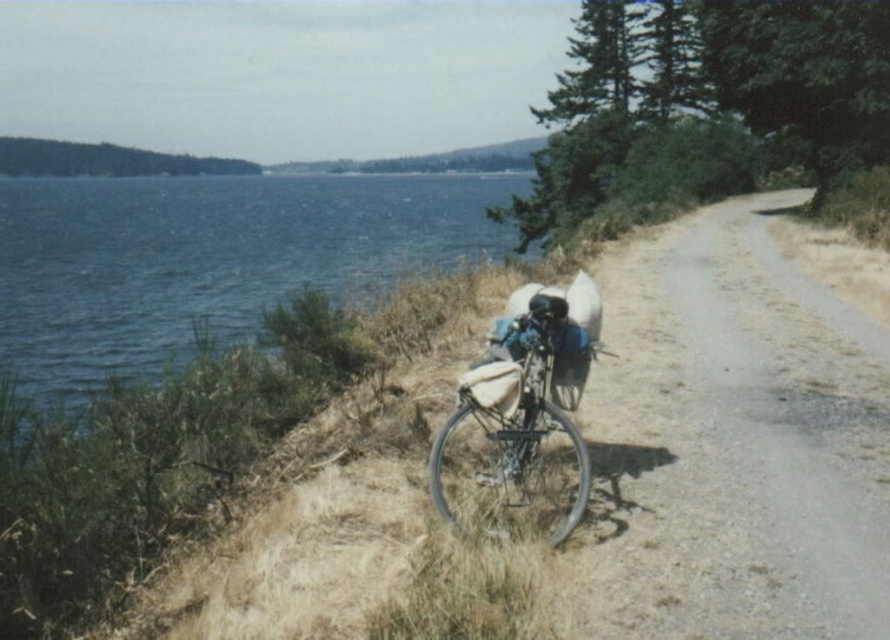
Question: Is gravel road at center positioned in front of blue water at left?

Choices:
 (A) no
 (B) yes

Answer: (B)

Question: Which point is farther from the camera taking this photo?

Choices:
 (A) (506, 232)
 (B) (531, 444)

Answer: (A)

Question: Does blue water at left come behind metallic silver bicycle at center?

Choices:
 (A) yes
 (B) no

Answer: (A)

Question: Which object is farther from the camera taking this photo?

Choices:
 (A) metallic silver bicycle at center
 (B) blue water at left

Answer: (B)

Question: Can you confirm if gravel road at center is thinner than metallic silver bicycle at center?

Choices:
 (A) no
 (B) yes

Answer: (A)

Question: Which object appears farthest from the camera in this image?

Choices:
 (A) gravel road at center
 (B) blue water at left
 (C) metallic silver bicycle at center

Answer: (B)